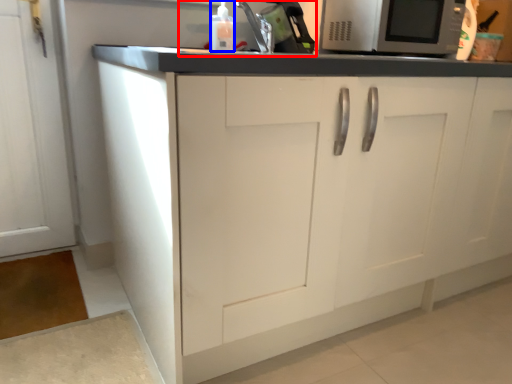
Question: Which object is closer to the camera taking this photo, sink (highlighted by a red box) or bottle (highlighted by a blue box)?

Choices:
 (A) sink
 (B) bottle

Answer: (B)